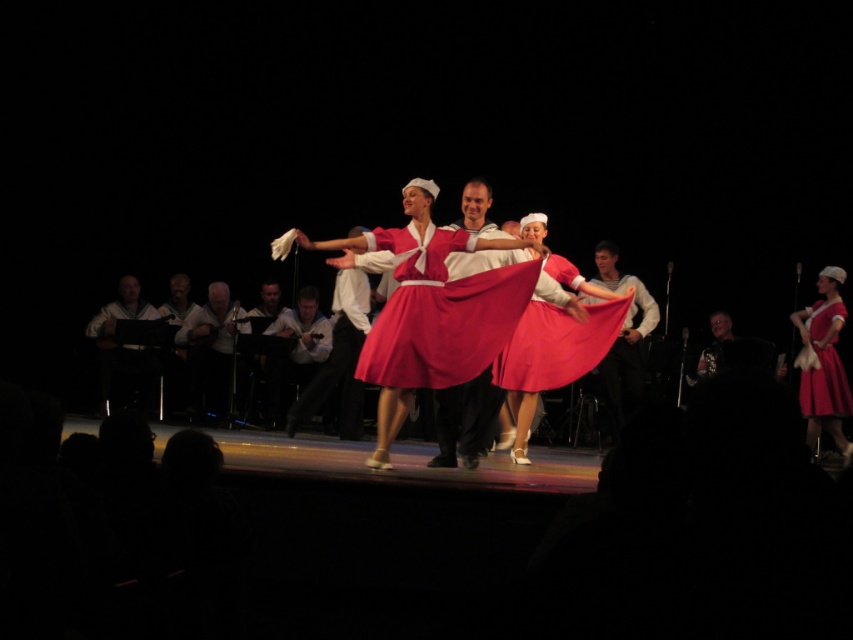
You are a photographer positioned at the center of the stage. You want to capture a photo of the matte red dress at right. Based on its position, where should you aim your camera to ensure it is centered in the frame?

The matte red dress at right is located at coordinates approximately 0.567 on the x axis and 0.967 on the y axis. To center it in your frame, aim your camera towards those coordinates.

You are a photographer positioned at the back of the stage. You want to capture a clear photo of both the matte pink fabric skirt at center and the white leather jacket at left. Which object will appear larger in your photo?

The matte pink fabric skirt at center will appear larger in the photo because it is closer to the viewer than the white leather jacket at left.